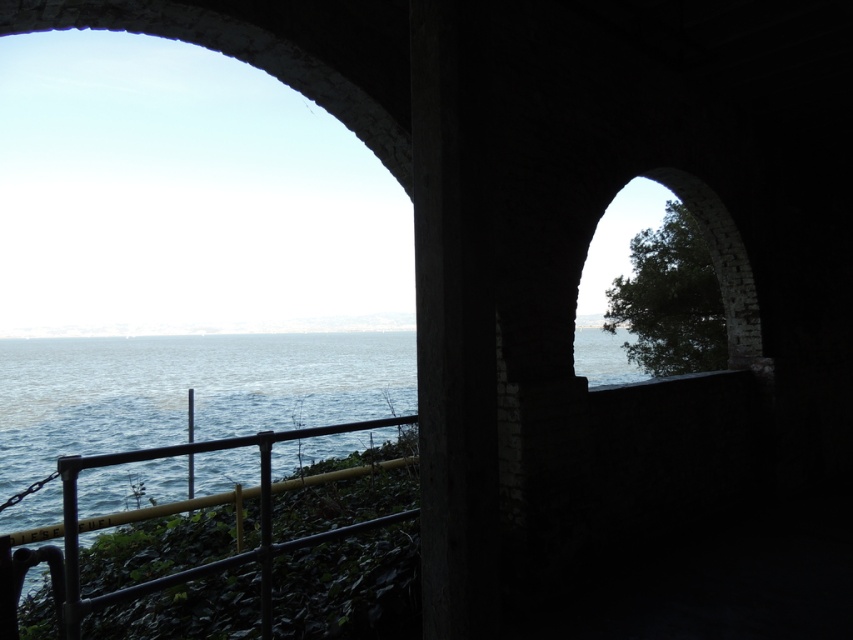
Consider the image. Is blue water at center thinner than black metal railing at lower left?

No, blue water at center is not thinner than black metal railing at lower left.

Which is behind, point (91, 406) or point (18, 564)?

Positioned behind is point (91, 406).

This screenshot has height=640, width=853. What are the coordinates of `blue water at center` in the screenshot? It's located at (186, 390).